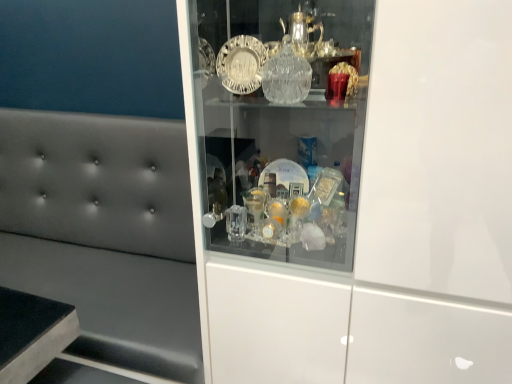
Describe the element at coordinates (105, 233) in the screenshot. The image size is (512, 384). I see `tufted leather couch at left` at that location.

Measure the distance between tufted leather couch at left and camera.

A distance of 3.77 feet exists between tufted leather couch at left and camera.

Where is `tufted leather couch at left`? tufted leather couch at left is located at coordinates (105, 233).

I want to click on tufted leather couch at left, so click(x=105, y=233).